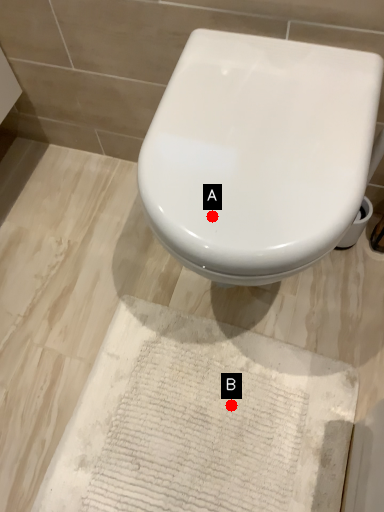
Question: Two points are circled on the image, labeled by A and B beside each circle. Among these points, which one is farthest from the camera?

Choices:
 (A) A is further
 (B) B is further

Answer: (B)